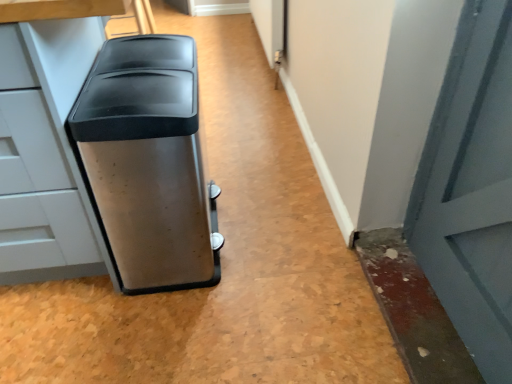
At what (x,y) coordinates should I click in order to perform the action: click on stainless steel trash can at center. Please return your answer as a coordinate pair (x, y). Image resolution: width=512 pixels, height=384 pixels. Looking at the image, I should click on (149, 163).

Image resolution: width=512 pixels, height=384 pixels. What do you see at coordinates (149, 163) in the screenshot? I see `stainless steel trash can at center` at bounding box center [149, 163].

You are a GUI agent. You are given a task and a screenshot of the screen. Output one action in this format:
    pyautogui.click(x=<x>, y=<y>)
    Task: Click on the satin metallic trash can at left
    This screenshot has width=512, height=384.
    Given the screenshot: What is the action you would take?
    pyautogui.click(x=42, y=151)

Describe the element at coordinates (42, 151) in the screenshot. I see `satin metallic trash can at left` at that location.

Find the location of a particular element. Image resolution: width=512 pixels, height=384 pixels. stainless steel trash can at center is located at coordinates (149, 163).

In the scene shown: Considering the relative positions of satin metallic trash can at left and stainless steel trash can at center in the image provided, is satin metallic trash can at left to the right of stainless steel trash can at center from the viewer's perspective?

No, satin metallic trash can at left is not to the right of stainless steel trash can at center.

Which object is further away from the camera taking this photo, satin metallic trash can at left or stainless steel trash can at center?

stainless steel trash can at center is further from the camera.

Is point (83, 256) in front of point (144, 229)?

No, (83, 256) is behind (144, 229).

From the picture: From the image's perspective, between satin metallic trash can at left and stainless steel trash can at center, who is located below?

stainless steel trash can at center appears lower in the image.

From a real-world perspective, relative to stainless steel trash can at center, is satin metallic trash can at left vertically above or below?

From a real-world perspective, satin metallic trash can at left is physically above stainless steel trash can at center.

Can you confirm if satin metallic trash can at left is thinner than stainless steel trash can at center?

Incorrect, the width of satin metallic trash can at left is not less than that of stainless steel trash can at center.

Who is shorter, satin metallic trash can at left or stainless steel trash can at center?

Standing shorter between the two is stainless steel trash can at center.

Who is smaller, satin metallic trash can at left or stainless steel trash can at center?

With smaller size is stainless steel trash can at center.

Is satin metallic trash can at left inside the boundaries of stainless steel trash can at center, or outside?

The correct answer is: outside.

Is satin metallic trash can at left next to stainless steel trash can at center and touching it?

There is a gap between satin metallic trash can at left and stainless steel trash can at center.

Does satin metallic trash can at left turn towards stainless steel trash can at center?

No, satin metallic trash can at left is not oriented towards stainless steel trash can at center.

Based on the photo, how different are the orientations of satin metallic trash can at left and stainless steel trash can at center in degrees?

89.7 degrees.

Locate an element on the screen. The height and width of the screenshot is (384, 512). cabinetry on the left of stainless steel trash can at center is located at coordinates (42, 151).

Based on their positions, is stainless steel trash can at center located to the left or right of satin metallic trash can at left?

Clearly, stainless steel trash can at center is on the right of satin metallic trash can at left in the image.

In the scene shown: Considering their positions, is stainless steel trash can at center located in front of or behind satin metallic trash can at left?

Visually, stainless steel trash can at center is located behind satin metallic trash can at left.

Does point (187, 251) lie in front of point (75, 27)?

That is False.

From the image's perspective, is stainless steel trash can at center positioned above or below satin metallic trash can at left?

stainless steel trash can at center is below satin metallic trash can at left.

From a real-world perspective, is stainless steel trash can at center physically located above or below satin metallic trash can at left?

stainless steel trash can at center is below satin metallic trash can at left.

Is stainless steel trash can at center thinner than satin metallic trash can at left?

Indeed, stainless steel trash can at center has a lesser width compared to satin metallic trash can at left.

Is stainless steel trash can at center taller than satin metallic trash can at left?

In fact, stainless steel trash can at center may be shorter than satin metallic trash can at left.

Who is smaller, stainless steel trash can at center or satin metallic trash can at left?

Smaller between the two is stainless steel trash can at center.

Is stainless steel trash can at center situated inside satin metallic trash can at left or outside?

stainless steel trash can at center can be found inside satin metallic trash can at left.

Is stainless steel trash can at center next to satin metallic trash can at left and touching it?

They are not placed beside each other.

Is stainless steel trash can at center oriented towards satin metallic trash can at left?

Yes, stainless steel trash can at center faces towards satin metallic trash can at left.

Measure the distance between stainless steel trash can at center and satin metallic trash can at left.

They are 18.36 centimeters apart.

Locate an element on the screen. This screenshot has width=512, height=384. cabinetry that is above the stainless steel trash can at center (from the image's perspective) is located at coordinates (42, 151).

Where is `cabinetry in front of the stainless steel trash can at center`? cabinetry in front of the stainless steel trash can at center is located at coordinates (42, 151).

Where is `cabinetry positioned vertically above the stainless steel trash can at center (from a real-world perspective)`? The image size is (512, 384). cabinetry positioned vertically above the stainless steel trash can at center (from a real-world perspective) is located at coordinates (42, 151).